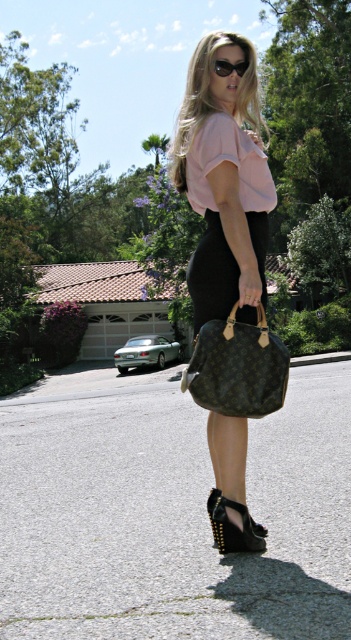
Question: Among these objects, which one is nearest to the camera?

Choices:
 (A) sunglasses at center
 (B) monogram canvas handbag at center

Answer: (B)

Question: Can you confirm if matte black dress at center is bigger than sunglasses at center?

Choices:
 (A) yes
 (B) no

Answer: (A)

Question: Is matte black dress at center below black studded leather sandal at lower center?

Choices:
 (A) yes
 (B) no

Answer: (B)

Question: Considering the real-world distances, which object is farthest from the black studded leather sandal at lower center?

Choices:
 (A) matte black dress at center
 (B) sunglasses at center

Answer: (B)

Question: Does matte black dress at center have a larger size compared to monogram canvas handbag at center?

Choices:
 (A) yes
 (B) no

Answer: (A)

Question: Considering the real-world distances, which object is closest to the black studded leather sandal at lower center?

Choices:
 (A) monogram canvas handbag at center
 (B) matte black dress at center
 (C) sunglasses at center

Answer: (B)